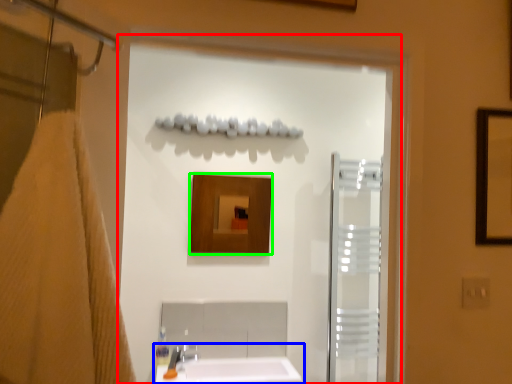
Question: Which object is the farthest from screen door (highlighted by a red box)? Choose among these: sink (highlighted by a blue box) or mirror (highlighted by a green box).

Choices:
 (A) sink
 (B) mirror

Answer: (A)